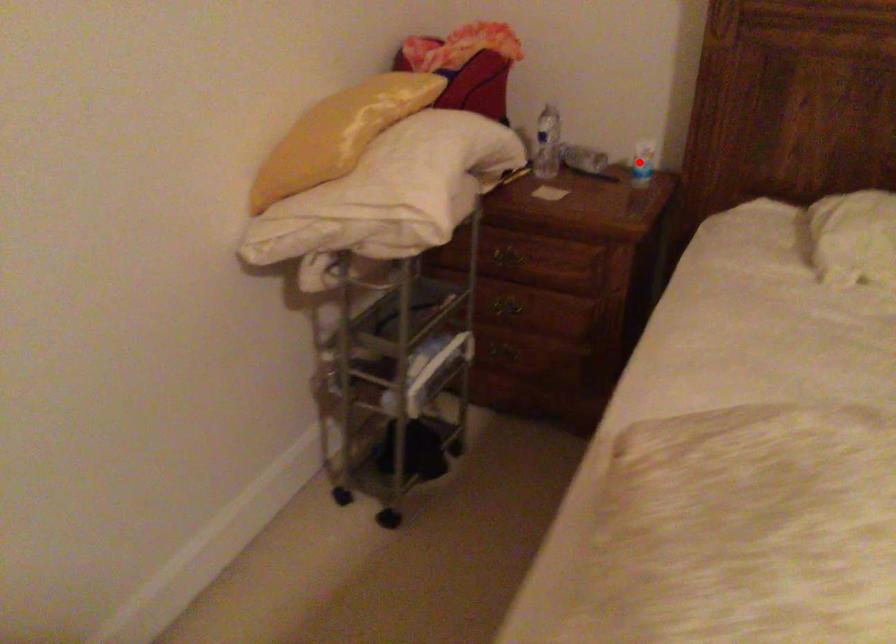
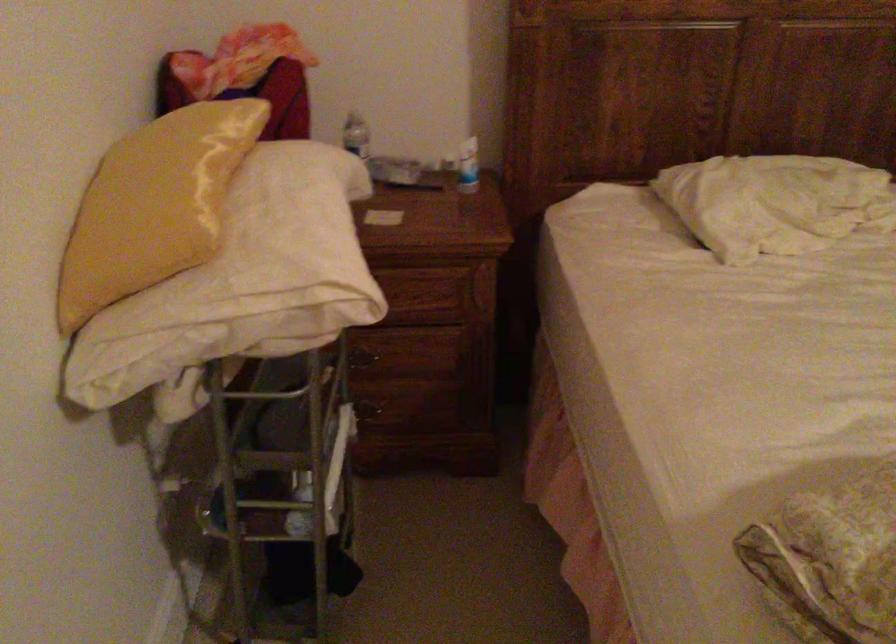
Question: I am providing you with two images of the same scene from different viewpoints. A red point is shown in image1. For the corresponding object point in image2, is it positioned nearer or farther from the camera?

Choices:
 (A) Nearer
 (B) Farther

Answer: (A)